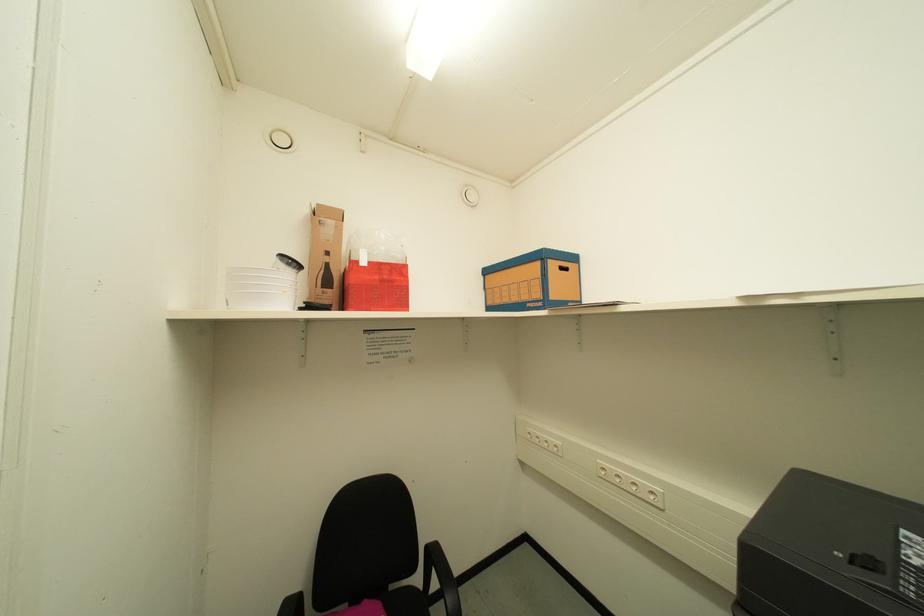
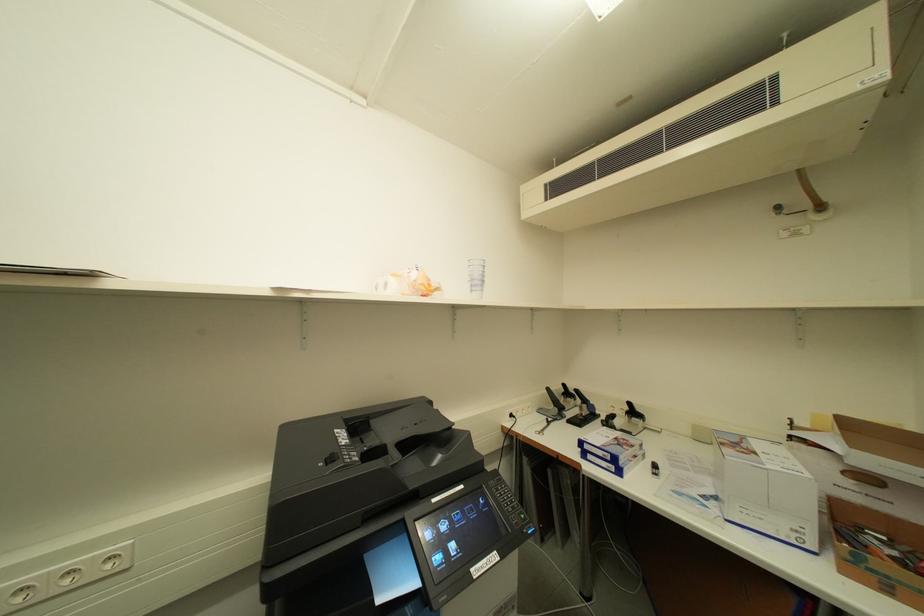
Question: The camera is either moving clockwise (left) or counter-clockwise (right) around the object. The first image is from the beginning of the video and the second image is from the end. Is the camera moving left or right when shooting the video?

Choices:
 (A) Left
 (B) Right

Answer: (A)